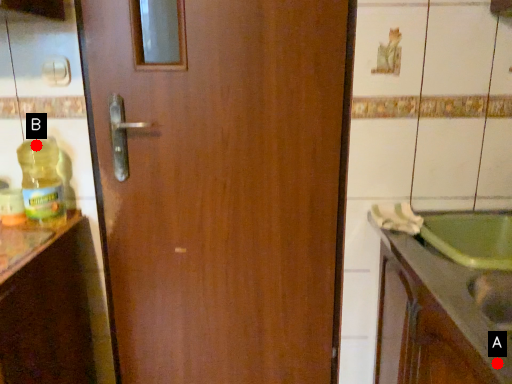
Question: Two points are circled on the image, labeled by A and B beside each circle. Which of the following is the closest to the observer?

Choices:
 (A) A is closer
 (B) B is closer

Answer: (A)